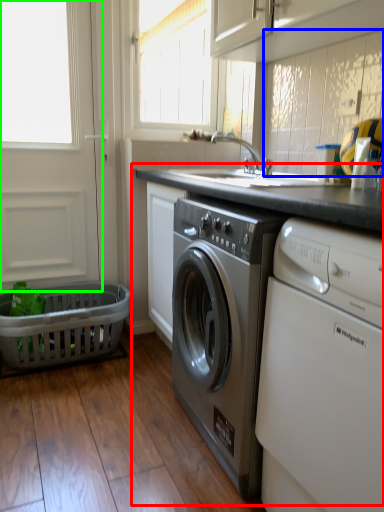
Question: Which is farther away from counter (highlighted by a red box)? cabinetry (highlighted by a blue box) or screen door (highlighted by a green box)?

Choices:
 (A) cabinetry
 (B) screen door

Answer: (B)